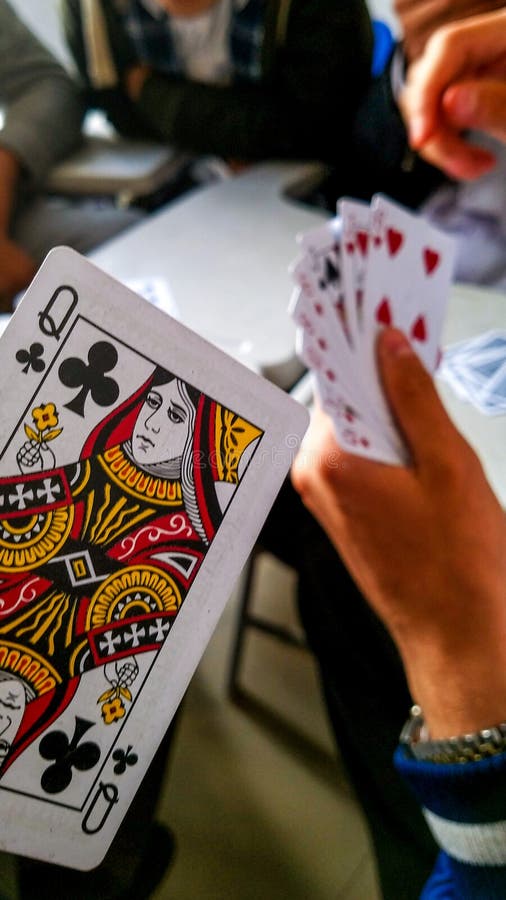
Identify the location of floor. The image size is (506, 900). (265, 777).